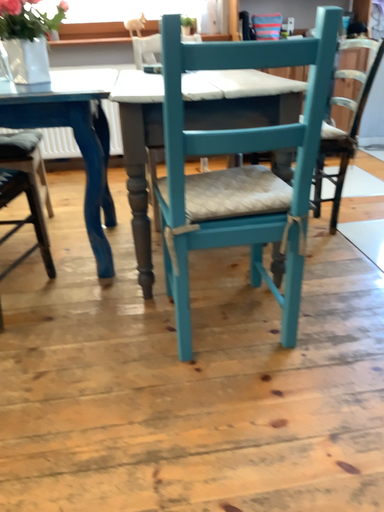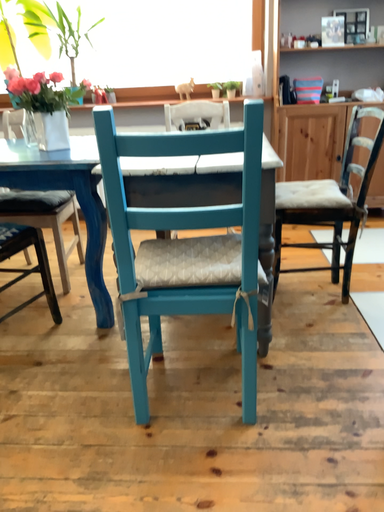
Question: How did the camera likely rotate when shooting the video?

Choices:
 (A) rotated right
 (B) rotated left

Answer: (B)